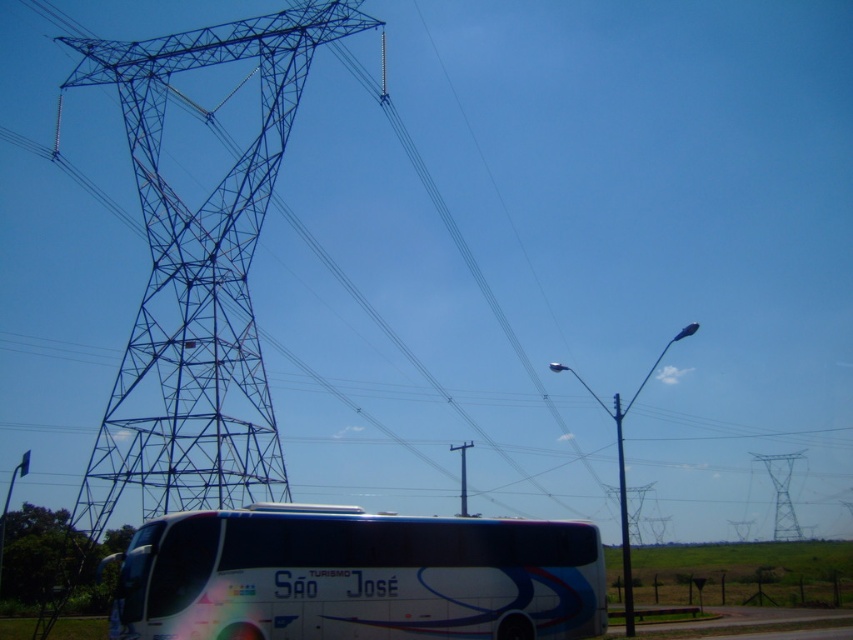
Question: In this image, where is metallic blue tower at left located relative to metallic gray pole at right?

Choices:
 (A) below
 (B) above

Answer: (B)

Question: Which point appears closest to the camera in this image?

Choices:
 (A) (775, 490)
 (B) (265, 81)
 (C) (241, 572)
 (D) (619, 477)

Answer: (C)

Question: Can you confirm if white glossy bus at lower center is positioned above metallic blue tower at right?

Choices:
 (A) no
 (B) yes

Answer: (A)

Question: Which point appears farthest from the camera in this image?

Choices:
 (A) (184, 484)
 (B) (200, 563)

Answer: (A)

Question: Which object is positioned farthest from the white glossy bus at lower center?

Choices:
 (A) metallic blue tower at left
 (B) metallic blue tower at right

Answer: (B)

Question: Can you confirm if metallic blue tower at left is positioned above white glossy bus at lower center?

Choices:
 (A) yes
 (B) no

Answer: (A)